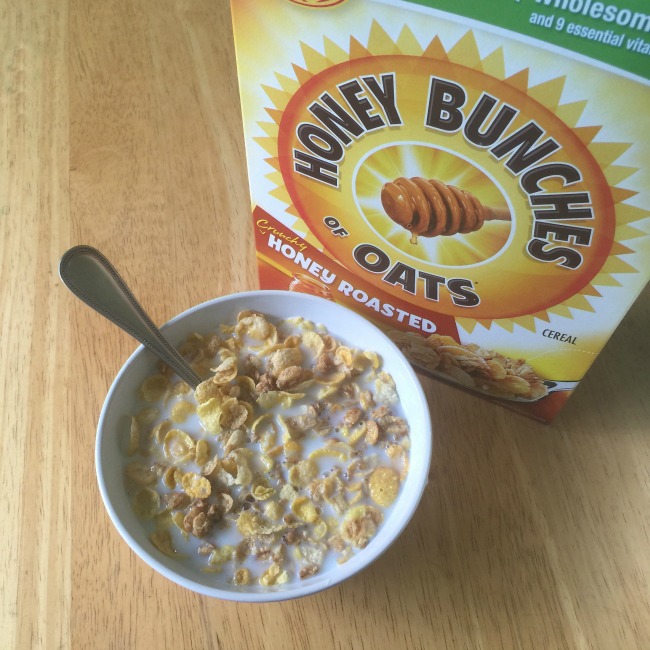
You are a GUI agent. You are given a task and a screenshot of the screen. Output one action in this format:
    pyautogui.click(x=<x>, y=<y>)
    Task: Click on the handle
    Image resolution: width=650 pixels, height=650 pixels.
    Given the screenshot: What is the action you would take?
    [x=127, y=317]